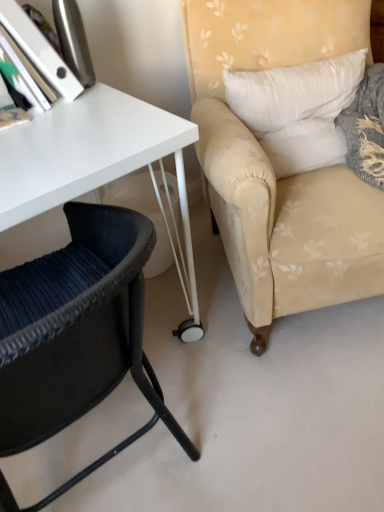
Question: Is black woven chair at lower left, arranged as the 2th chair when viewed from the right, thinner than white fabric pillow at upper right?

Choices:
 (A) no
 (B) yes

Answer: (A)

Question: Does black woven chair at lower left, which ranks as the 1th chair in left-to-right order, have a smaller size compared to white fabric pillow at upper right?

Choices:
 (A) no
 (B) yes

Answer: (A)

Question: Could you tell me if black woven chair at lower left, arranged as the 2th chair when viewed from the right, is turned towards white fabric pillow at upper right?

Choices:
 (A) yes
 (B) no

Answer: (B)

Question: From the image's perspective, does black woven chair at lower left, arranged as the 2th chair when viewed from the right, appear higher than white fabric pillow at upper right?

Choices:
 (A) no
 (B) yes

Answer: (A)

Question: From a real-world perspective, is black woven chair at lower left, which ranks as the 1th chair in left-to-right order, under white fabric pillow at upper right?

Choices:
 (A) yes
 (B) no

Answer: (A)

Question: Is black woven chair at lower left, arranged as the 2th chair when viewed from the right, completely or partially outside of white fabric pillow at upper right?

Choices:
 (A) no
 (B) yes

Answer: (B)

Question: Is beige floral fabric armchair at right, which is the second chair in left-to-right order, thinner than white fabric pillow at upper right?

Choices:
 (A) yes
 (B) no

Answer: (B)

Question: Considering the relative sizes of beige floral fabric armchair at right, which is counted as the 1th chair, starting from the right, and white fabric pillow at upper right in the image provided, is beige floral fabric armchair at right, which is counted as the 1th chair, starting from the right, shorter than white fabric pillow at upper right?

Choices:
 (A) no
 (B) yes

Answer: (A)

Question: Does beige floral fabric armchair at right, which is counted as the 1th chair, starting from the right, come in front of white fabric pillow at upper right?

Choices:
 (A) yes
 (B) no

Answer: (A)

Question: Is beige floral fabric armchair at right, which is counted as the 1th chair, starting from the right, next to white fabric pillow at upper right and touching it?

Choices:
 (A) yes
 (B) no

Answer: (B)

Question: Is white fabric pillow at upper right located within beige floral fabric armchair at right, which is the second chair in left-to-right order?

Choices:
 (A) no
 (B) yes

Answer: (B)

Question: Considering the relative sizes of beige floral fabric armchair at right, which is counted as the 1th chair, starting from the right, and white fabric pillow at upper right in the image provided, is beige floral fabric armchair at right, which is counted as the 1th chair, starting from the right, smaller than white fabric pillow at upper right?

Choices:
 (A) no
 (B) yes

Answer: (A)

Question: Is black woven chair at lower left, arranged as the 2th chair when viewed from the right, taller than beige floral fabric armchair at right, which is counted as the 1th chair, starting from the right?

Choices:
 (A) no
 (B) yes

Answer: (A)